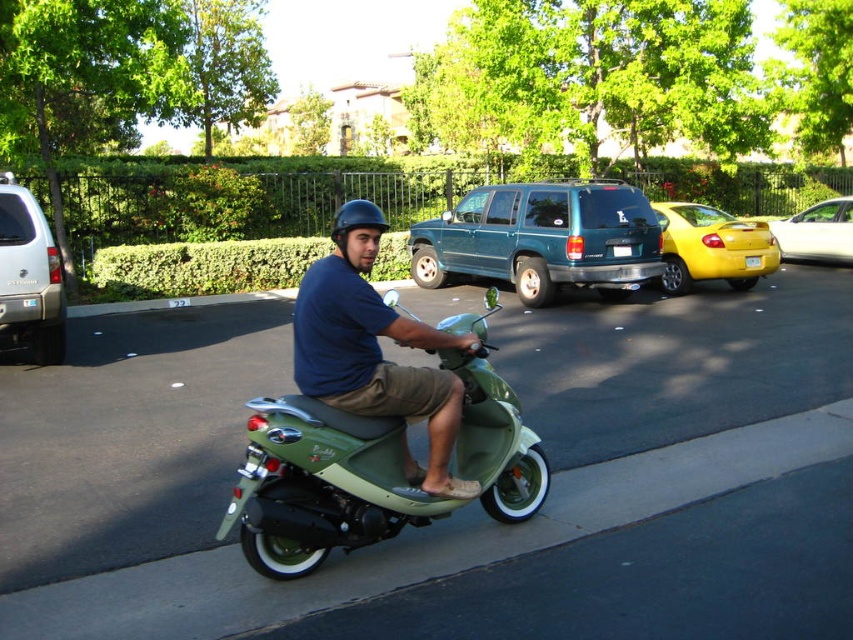
Question: Does teal matte suv at center lie in front of yellow plastic license plate at center?

Choices:
 (A) no
 (B) yes

Answer: (B)

Question: Among these objects, which one is nearest to the camera?

Choices:
 (A) yellow matte car at center
 (B) white plastic license plate at center
 (C) yellow plastic license plate at center
 (D) matte green scooter at center

Answer: (D)

Question: Which point is closer to the camera taking this photo?

Choices:
 (A) (809, 218)
 (B) (677, 262)
 (C) (357, 464)
 (D) (45, 332)

Answer: (C)

Question: Is the position of silver metallic suv at left more distant than that of black matte helmet at center?

Choices:
 (A) yes
 (B) no

Answer: (A)

Question: Is white glossy sedan at right positioned before black matte helmet at center?

Choices:
 (A) yes
 (B) no

Answer: (B)

Question: Which point is closer to the camera taking this photo?

Choices:
 (A) (616, 250)
 (B) (28, 285)
 (C) (285, 525)
 (D) (757, 259)

Answer: (C)